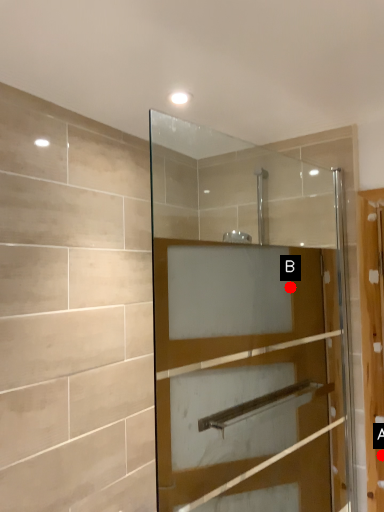
Question: Two points are circled on the image, labeled by A and B beside each circle. Among these points, which one is farthest from the camera?

Choices:
 (A) A is further
 (B) B is further

Answer: (B)